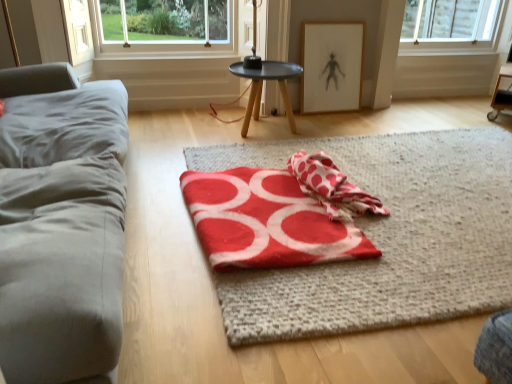
Where is `vacant area to the right of red felt beach towel at center, which is the first beach towel in left-to-right order`? This screenshot has height=384, width=512. vacant area to the right of red felt beach towel at center, which is the first beach towel in left-to-right order is located at coordinates (429, 222).